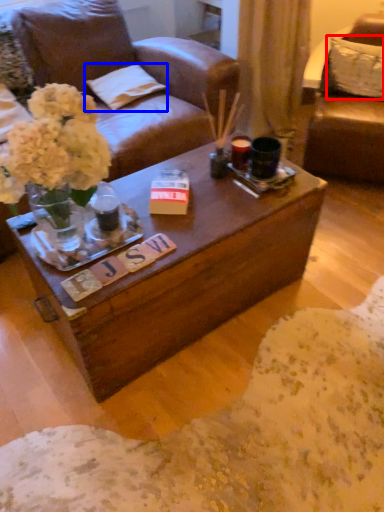
Question: Which point is further to the camera, pillow (highlighted by a red box) or pillow (highlighted by a blue box)?

Choices:
 (A) pillow
 (B) pillow

Answer: (B)